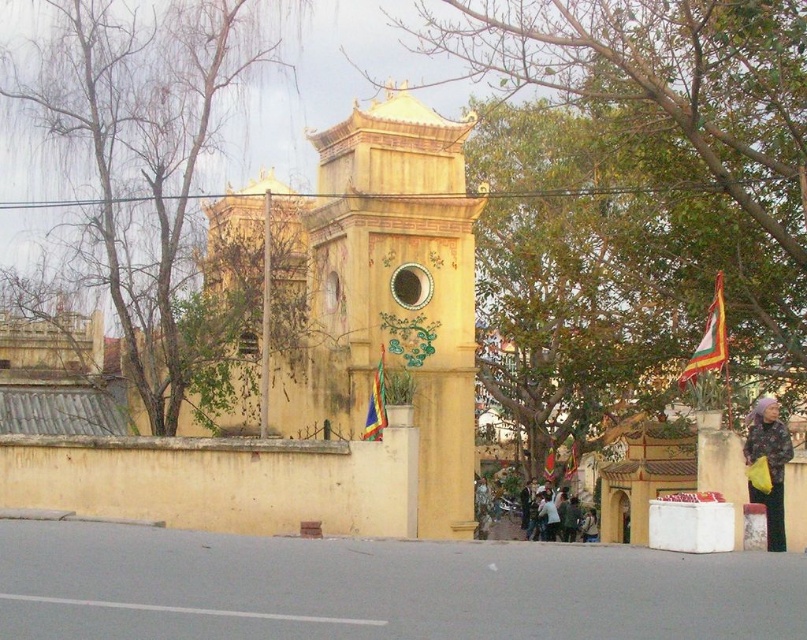
Question: Does yellow matte bell tower at center have a greater width compared to triangular fabric flag at center?

Choices:
 (A) yes
 (B) no

Answer: (A)

Question: Which object is positioned farthest from the multicolored fabric flag at upper right?

Choices:
 (A) green leafy tree at upper left
 (B) green leafy tree at center
 (C) triangular fabric flag at center

Answer: (A)

Question: Does yellow matte bell tower at center appear on the left side of multicolored fabric flag at upper right?

Choices:
 (A) yes
 (B) no

Answer: (A)

Question: Which point appears farthest from the camera in this image?

Choices:
 (A) (544, 497)
 (B) (617, 257)
 (C) (395, 196)

Answer: (A)

Question: Does yellow matte tower at center lie in front of multicolored fabric flag at upper right?

Choices:
 (A) no
 (B) yes

Answer: (A)

Question: Based on their relative distances, which object is farther from the multicolored fabric flag at upper right?

Choices:
 (A) yellow matte tower at center
 (B) triangular fabric flag at center
 (C) green leafy tree at upper left

Answer: (C)